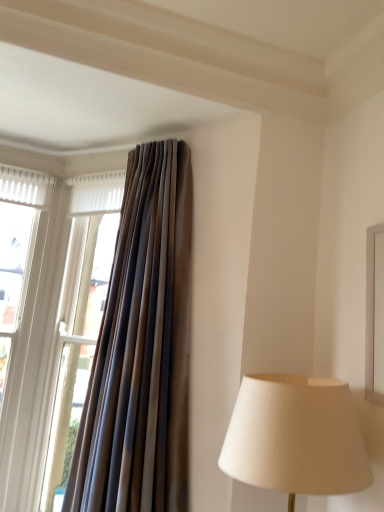
This screenshot has width=384, height=512. What are the coordinates of `brown textured curtain at upper left` in the screenshot? It's located at (141, 349).

In the scene shown: What is the approximate height of brown textured curtain at upper left?

brown textured curtain at upper left is 6.03 feet tall.

What is the approximate width of brown textured curtain at upper left?

13.62 inches.

The width and height of the screenshot is (384, 512). What do you see at coordinates (141, 349) in the screenshot?
I see `brown textured curtain at upper left` at bounding box center [141, 349].

Identify the location of matte brown curtain at left. The height and width of the screenshot is (512, 384). (49, 320).

Describe the element at coordinates (49, 320) in the screenshot. I see `matte brown curtain at left` at that location.

In order to click on brown textured curtain at upper left in this screenshot , I will do `click(141, 349)`.

Between matte brown curtain at left and brown textured curtain at upper left, which one appears on the left side from the viewer's perspective?

matte brown curtain at left.

Which object is further away from the camera taking this photo, matte brown curtain at left or brown textured curtain at upper left?

Positioned behind is matte brown curtain at left.

Which is in front, point (80, 351) or point (157, 371)?

The point (157, 371) is in front.

From the image's perspective, who appears lower, matte brown curtain at left or brown textured curtain at upper left?

matte brown curtain at left.

From a real-world perspective, which object rests below the other?

matte brown curtain at left.

Which of these two, matte brown curtain at left or brown textured curtain at upper left, is thinner?

matte brown curtain at left.

In the scene shown: Which of these two, matte brown curtain at left or brown textured curtain at upper left, stands shorter?

Standing shorter between the two is matte brown curtain at left.

Can you confirm if matte brown curtain at left is smaller than brown textured curtain at upper left?

Yes, matte brown curtain at left is smaller than brown textured curtain at upper left.

Is brown textured curtain at upper left located within matte brown curtain at left?

No, matte brown curtain at left does not contain brown textured curtain at upper left.

Is matte brown curtain at left positioned far away from brown textured curtain at upper left?

No, matte brown curtain at left is not far away from brown textured curtain at upper left.

Is matte brown curtain at left oriented towards brown textured curtain at upper left?

No, matte brown curtain at left is not oriented towards brown textured curtain at upper left.

Measure the distance from matte brown curtain at left to brown textured curtain at upper left.

A distance of 23.74 inches exists between matte brown curtain at left and brown textured curtain at upper left.

This screenshot has height=512, width=384. I want to click on curtain above the matte brown curtain at left (from the image's perspective), so click(x=141, y=349).

Is brown textured curtain at upper left to the left of matte brown curtain at left from the viewer's perspective?

No.

Between brown textured curtain at upper left and matte brown curtain at left, which one is positioned behind?

matte brown curtain at left.

Which is behind, point (117, 337) or point (18, 345)?

The point (18, 345) is farther from the camera.

From the image's perspective, does brown textured curtain at upper left appear lower than matte brown curtain at left?

No, from the image's perspective, brown textured curtain at upper left is not below matte brown curtain at left.

From a real-world perspective, is brown textured curtain at upper left physically below matte brown curtain at left?

No, from a real-world perspective, brown textured curtain at upper left is not beneath matte brown curtain at left.

Which of these two, brown textured curtain at upper left or matte brown curtain at left, is wider?

With larger width is brown textured curtain at upper left.

Who is taller, brown textured curtain at upper left or matte brown curtain at left?

brown textured curtain at upper left is taller.

Considering the relative sizes of brown textured curtain at upper left and matte brown curtain at left in the image provided, is brown textured curtain at upper left bigger than matte brown curtain at left?

Yes.

Does brown textured curtain at upper left contain matte brown curtain at left?

No, matte brown curtain at left is not a part of brown textured curtain at upper left.

Is brown textured curtain at upper left in contact with matte brown curtain at left?

They are not placed beside each other.

Is brown textured curtain at upper left aimed at matte brown curtain at left?

No, brown textured curtain at upper left is not oriented towards matte brown curtain at left.

Identify the location of curtain located above the matte brown curtain at left (from a real-world perspective). (141, 349).

What are the coordinates of `curtain above the matte brown curtain at left (from a real-world perspective)` in the screenshot? It's located at (141, 349).

At what (x,y) coordinates should I click in order to perform the action: click on window located below the brown textured curtain at upper left (from the image's perspective). Please return your answer as a coordinate pair (x, y). The image size is (384, 512). Looking at the image, I should click on (49, 320).